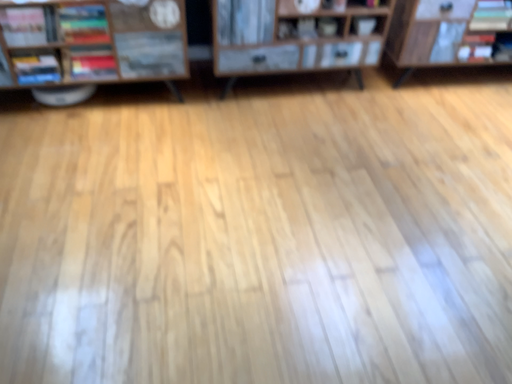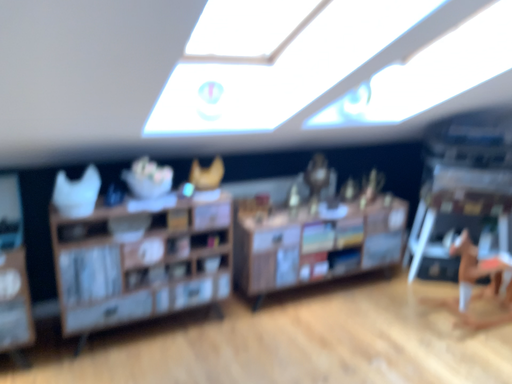
Question: How did the camera likely rotate when shooting the video?

Choices:
 (A) rotated upward
 (B) rotated downward

Answer: (A)